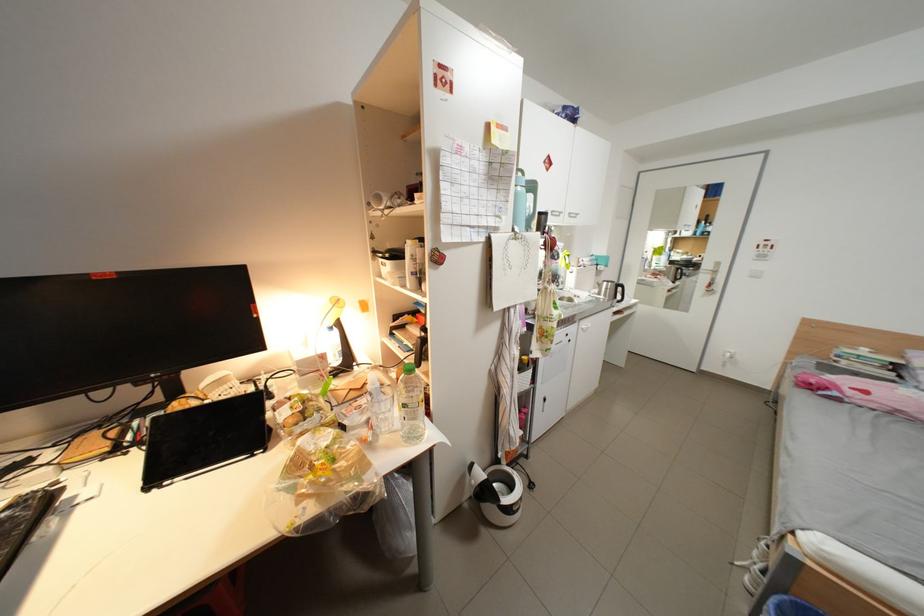
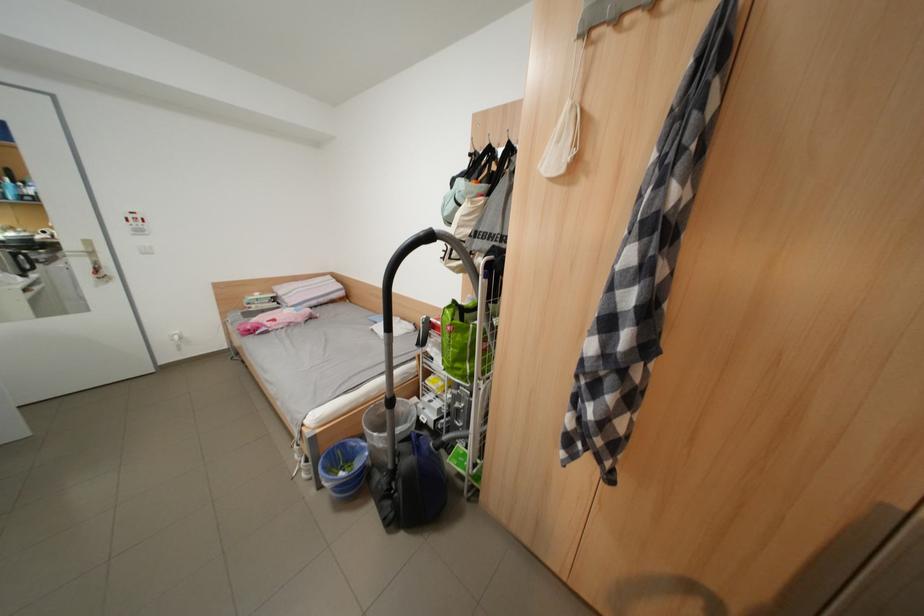
Based on the continuous images, in which direction is the camera rotating?

The rotation direction of the camera is right-down.